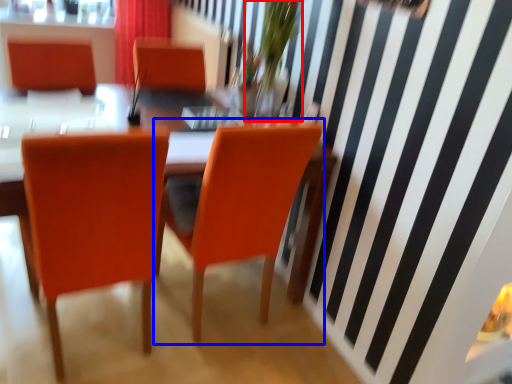
Question: Among these objects, which one is nearest to the camera, floral arrangement (highlighted by a red box) or chair (highlighted by a blue box)?

Choices:
 (A) floral arrangement
 (B) chair

Answer: (B)